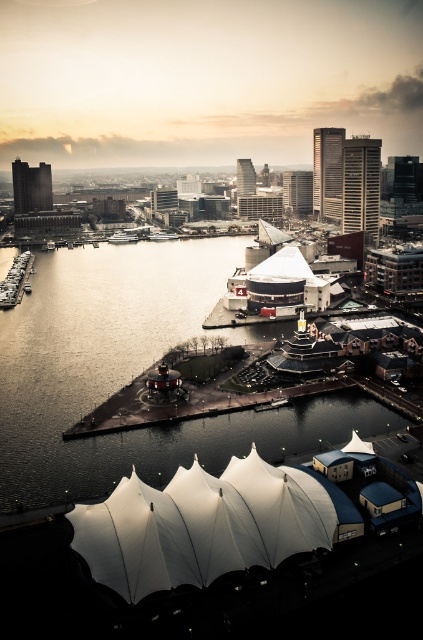
Which is more to the right, silvery water at center or white fabric umbrella at lower center?

white fabric umbrella at lower center is more to the right.

Is point (238, 433) positioned after point (175, 504)?

Yes, it is.

Does point (393, 416) come in front of point (90, 529)?

No.

The width and height of the screenshot is (423, 640). I want to click on silvery water at center, so click(129, 372).

Who is more forward, (158,572) or (351,440)?

Point (158,572) is in front.

Who is higher up, white fabric umbrella at lower center or white fabric canopy at center?

white fabric canopy at center is above.

Does point (79, 509) come farther from viewer compared to point (353, 442)?

No, (79, 509) is in front of (353, 442).

You are a GUI agent. You are given a task and a screenshot of the screen. Output one action in this format:
    pyautogui.click(x=<x>, y=<y>)
    Task: Click on the white fabric umbrella at lower center
    The image size is (423, 640).
    Given the screenshot: What is the action you would take?
    pyautogui.click(x=208, y=524)

In the scene shown: Does silvery water at center lie in front of white fabric canopy at center?

That is True.

Describe the element at coordinates (129, 372) in the screenshot. This screenshot has height=640, width=423. I see `silvery water at center` at that location.

You are a GUI agent. You are given a task and a screenshot of the screen. Output one action in this format:
    pyautogui.click(x=<x>, y=<y>)
    Task: Click on the silvery water at center
    This screenshot has height=640, width=423.
    Given the screenshot: What is the action you would take?
    pyautogui.click(x=129, y=372)